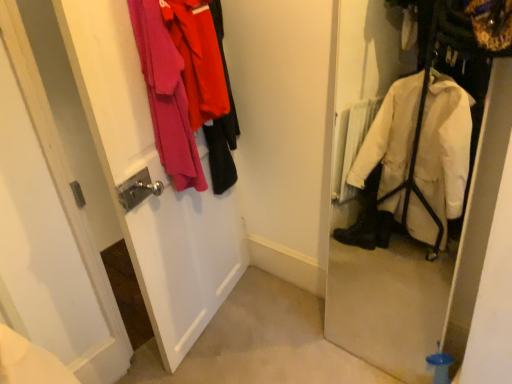
Question: Does white matte door at left have a lesser height compared to velvet pink coat at left?

Choices:
 (A) no
 (B) yes

Answer: (A)

Question: From the image's perspective, is white matte door at left located above velvet pink coat at left?

Choices:
 (A) no
 (B) yes

Answer: (A)

Question: From the image's perspective, would you say white matte door at left is shown under velvet pink coat at left?

Choices:
 (A) no
 (B) yes

Answer: (B)

Question: From a real-world perspective, is white matte door at left positioned under velvet pink coat at left based on gravity?

Choices:
 (A) yes
 (B) no

Answer: (A)

Question: Does white matte door at left have a greater height compared to velvet pink coat at left?

Choices:
 (A) no
 (B) yes

Answer: (B)

Question: Is white matte door at left positioned behind velvet pink coat at left?

Choices:
 (A) yes
 (B) no

Answer: (B)

Question: Would you say velvet pink coat at left is a long distance from white matte door at left?

Choices:
 (A) yes
 (B) no

Answer: (B)

Question: Could you tell me if velvet pink coat at left is turned towards white matte door at left?

Choices:
 (A) yes
 (B) no

Answer: (B)

Question: Is white matte door at left surrounded by velvet pink coat at left?

Choices:
 (A) yes
 (B) no

Answer: (B)

Question: Considering the relative positions of velvet pink coat at left and white matte door at left in the image provided, is velvet pink coat at left to the left of white matte door at left from the viewer's perspective?

Choices:
 (A) yes
 (B) no

Answer: (B)

Question: From the image's perspective, is velvet pink coat at left under white matte door at left?

Choices:
 (A) yes
 (B) no

Answer: (B)

Question: From a real-world perspective, is velvet pink coat at left over white matte door at left?

Choices:
 (A) no
 (B) yes

Answer: (B)

Question: From the image's perspective, is velvet pink coat at left above or below white matte door at left?

Choices:
 (A) below
 (B) above

Answer: (B)